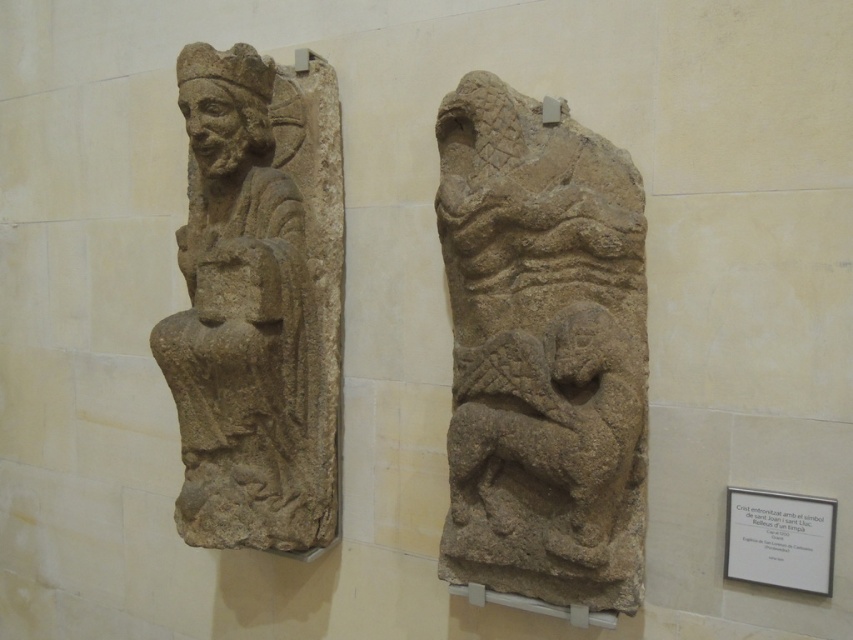
Question: Which point appears farthest from the camera in this image?

Choices:
 (A) (558, 220)
 (B) (167, 378)

Answer: (B)

Question: Does gray stone dragon at right have a greater width compared to stone carving of seated figure at left?

Choices:
 (A) no
 (B) yes

Answer: (A)

Question: Observing the image, what is the correct spatial positioning of gray stone dragon at right in reference to stone carving of seated figure at left?

Choices:
 (A) below
 (B) above

Answer: (A)

Question: Is gray stone dragon at right smaller than stone carving of seated figure at left?

Choices:
 (A) yes
 (B) no

Answer: (A)